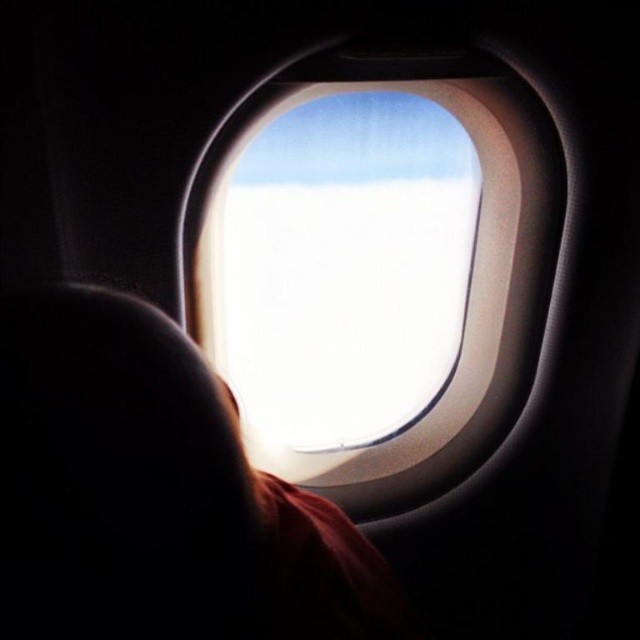
You are a flight attendant checking the cabin. You notice the silky red hair at center and the transparent glass airplane window at center. Which object is nearer to you as you stand in the aisle?

The silky red hair at center is closer to the viewer than the transparent glass airplane window at center, so the silky red hair at center is nearer to you.